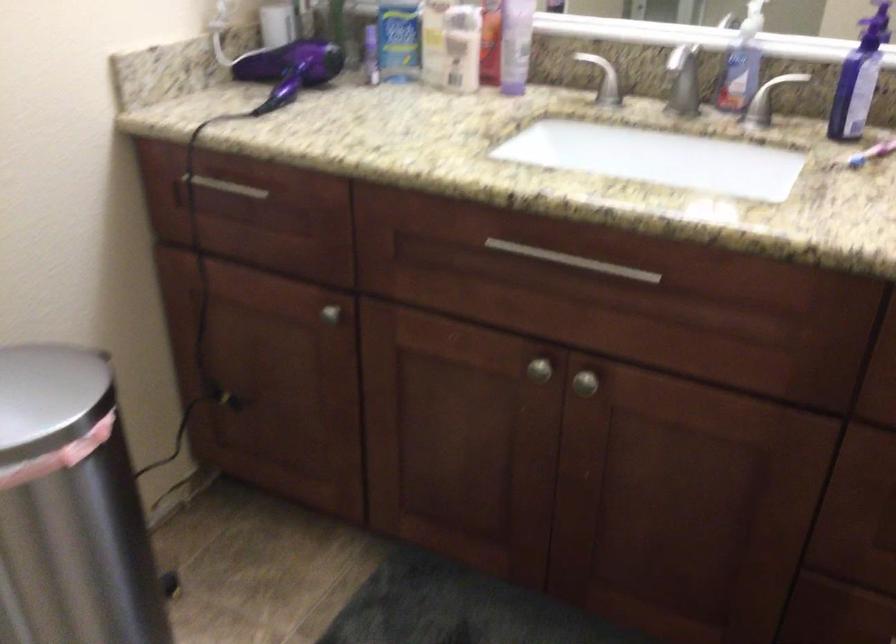
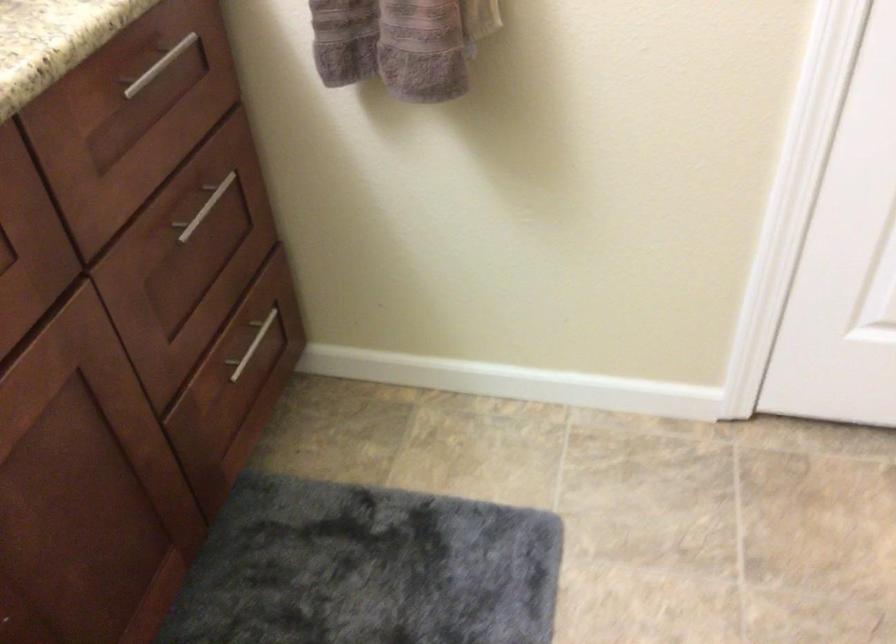
Based on the continuous images, in which direction is the camera rotating?

The camera's rotation is toward right-down.